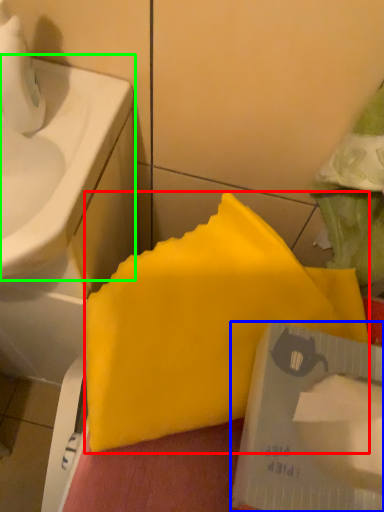
Question: Estimate the real-world distances between objects in this image. Which object is closer to waste (highlighted by a red box), writing (highlighted by a blue box) or sink (highlighted by a green box)?

Choices:
 (A) writing
 (B) sink

Answer: (A)